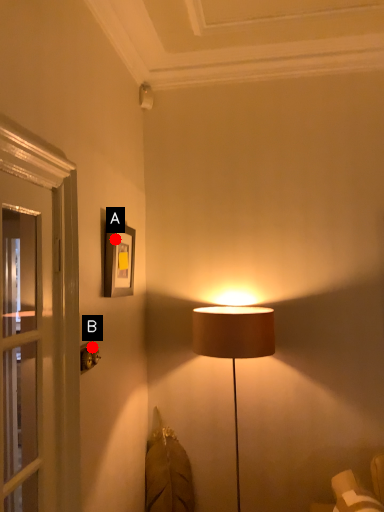
Question: Two points are circled on the image, labeled by A and B beside each circle. Which point appears closest to the camera in this image?

Choices:
 (A) A is closer
 (B) B is closer

Answer: (B)